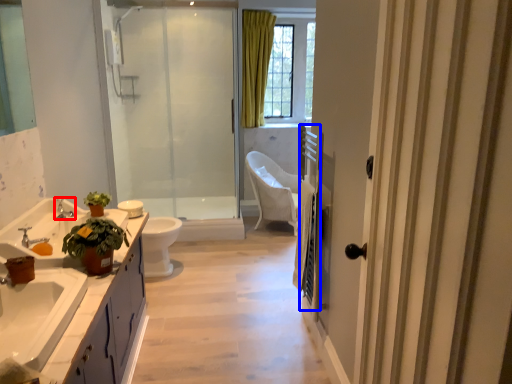
Question: Which object appears closest to the camera in this image, tap (highlighted by a red box) or balustrade (highlighted by a blue box)?

Choices:
 (A) tap
 (B) balustrade

Answer: (B)